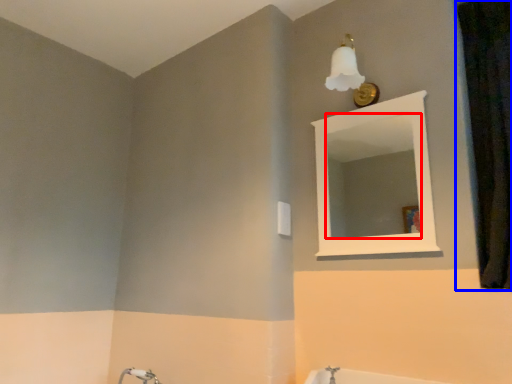
Question: Which of the following is the closest to the observer, mirror (highlighted by a red box) or curtain (highlighted by a blue box)?

Choices:
 (A) mirror
 (B) curtain

Answer: (B)